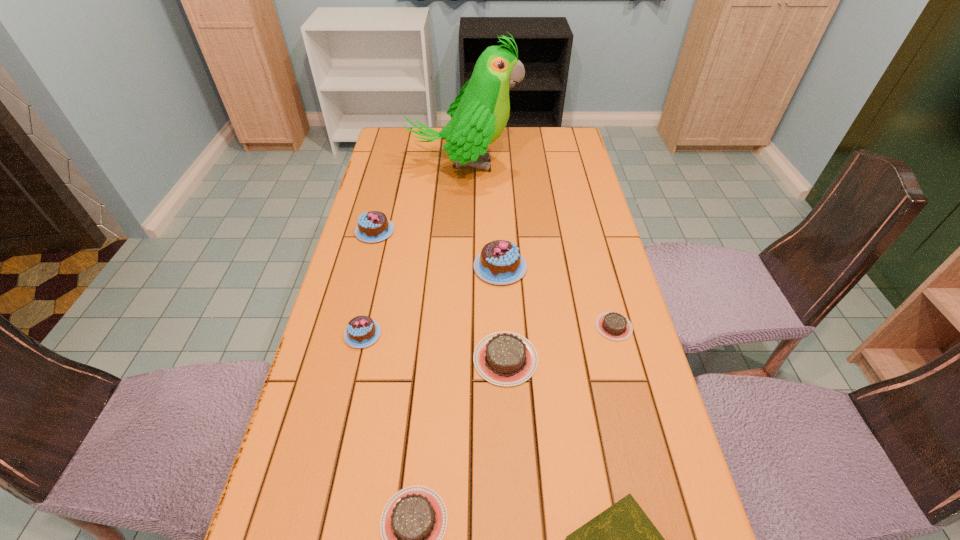
Select which object appears as the second closest to the second farthest object. Please provide its 2D coordinates. Your answer should be formatted as a tuple, i.e. [(x, y)], where the tuple contains the x and y coordinates of a point satisfying the conditions above.

[(500, 262)]

This screenshot has height=540, width=960. I want to click on the third closest chocolate cake to the leftmost brown chocolate cake, so coord(612,325).

This screenshot has width=960, height=540. Identify the location of chocolate cake that stands as the fifth closest to the tallest chocolate cake. (413, 522).

Choose which pink chocolate cake is the nearest neighbor to the third shortest object. Please provide its 2D coordinates. Your answer should be formatted as a tuple, i.e. [(x, y)], where the tuple contains the x and y coordinates of a point satisfying the conditions above.

[(362, 331)]

Find the location of a particular element. the closest pink chocolate cake to the nearest brown chocolate cake is located at coordinates (362, 331).

Select which brown chocolate cake is the third closest to the fourth tallest object. Please provide its 2D coordinates. Your answer should be formatted as a tuple, i.e. [(x, y)], where the tuple contains the x and y coordinates of a point satisfying the conditions above.

[(612, 325)]

Identify which brown chocolate cake is located as the second nearest to the biggest brown chocolate cake. Please provide its 2D coordinates. Your answer should be formatted as a tuple, i.e. [(x, y)], where the tuple contains the x and y coordinates of a point satisfying the conditions above.

[(413, 522)]

You are a GUI agent. You are given a task and a screenshot of the screen. Output one action in this format:
    pyautogui.click(x=<x>, y=<y>)
    Task: Click on the vacant region that satisfies the following two spatial constraints: 1. on the back side of the rightmost brown chocolate cake; 2. on the beak of the green parakeet
    The height and width of the screenshot is (540, 960).
    Given the screenshot: What is the action you would take?
    pyautogui.click(x=571, y=165)